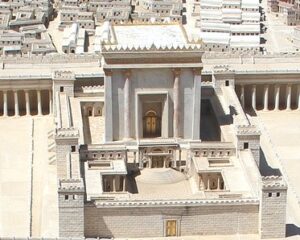
Where is `pillars`? The height and width of the screenshot is (240, 300). pillars is located at coordinates (289, 92), (276, 96), (264, 96), (254, 97), (38, 103), (28, 106), (15, 103).